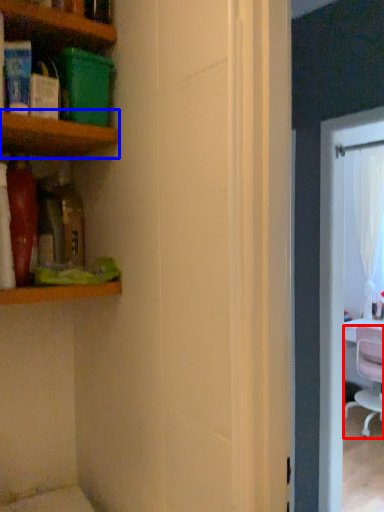
Question: Among these objects, which one is farthest to the camera, chair (highlighted by a red box) or shelf (highlighted by a blue box)?

Choices:
 (A) chair
 (B) shelf

Answer: (A)